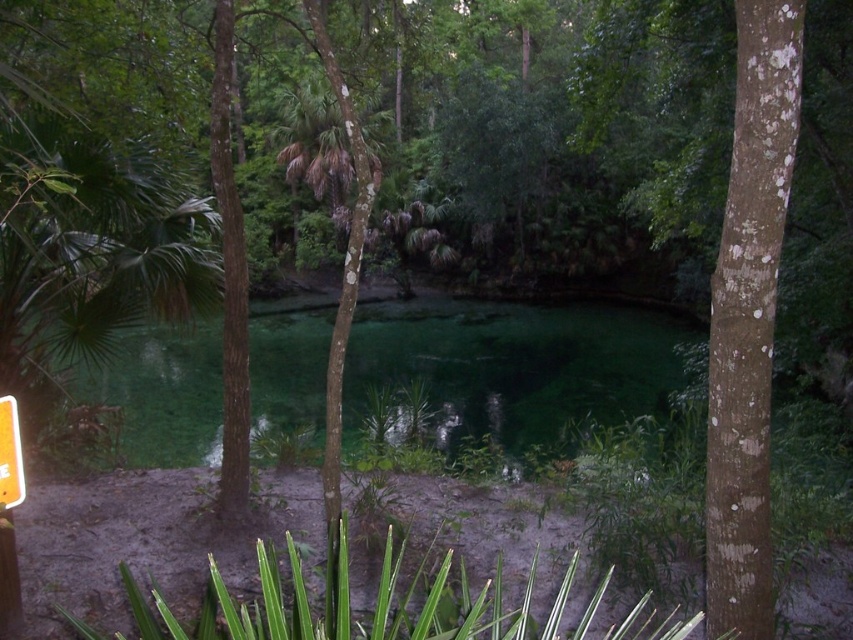
Is green translucent water at center to the left of brown rough bark tree at right from the viewer's perspective?

Indeed, green translucent water at center is positioned on the left side of brown rough bark tree at right.

Between green translucent water at center and brown rough bark tree at right, which one appears on the left side from the viewer's perspective?

Positioned to the left is green translucent water at center.

Which is in front, point (198, 394) or point (733, 173)?

Point (733, 173) is in front.

Locate an element on the screen. green translucent water at center is located at coordinates (514, 364).

Who is more forward, (743, 148) or (15, 428)?

Positioned in front is point (743, 148).

Does brown rough bark tree at right have a larger size compared to orange plastic sign at lower left?

Yes.

Locate an element on the screen. The width and height of the screenshot is (853, 640). brown rough bark tree at right is located at coordinates (747, 317).

Does green translucent water at center have a greater width compared to orange plastic sign at lower left?

Yes.

Can you confirm if green translucent water at center is taller than orange plastic sign at lower left?

Indeed, green translucent water at center has a greater height compared to orange plastic sign at lower left.

Identify the location of green translucent water at center. The image size is (853, 640). (514, 364).